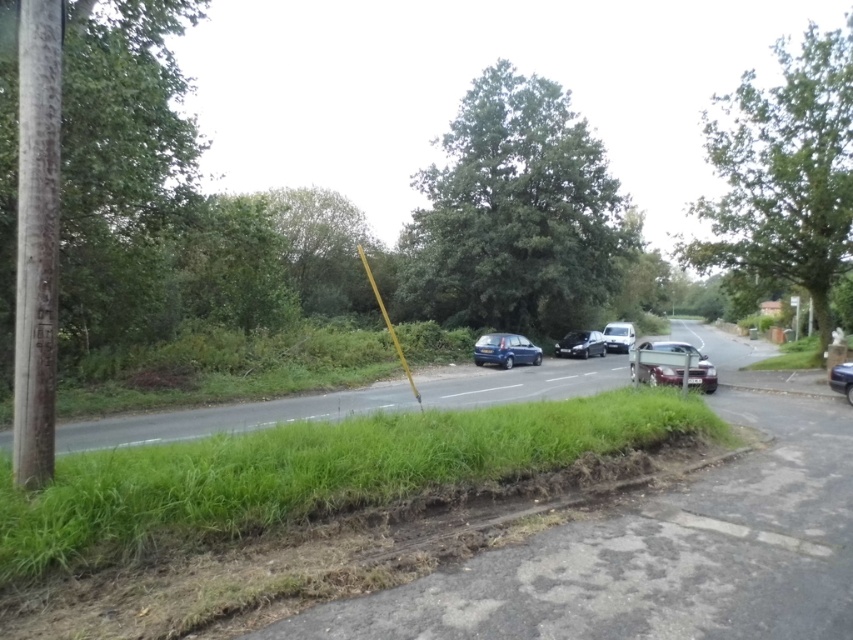
Question: Which of these objects is positioned closest to the green leafy tree at upper center?

Choices:
 (A) shiny silver car at center
 (B) satin black car at center

Answer: (B)

Question: Is shiny metallic car at center bigger than shiny blue sedan at right?

Choices:
 (A) no
 (B) yes

Answer: (B)

Question: Which object is positioned closest to the shiny silver car at center?

Choices:
 (A) satin black car at center
 (B) matte blue hatchback at center
 (C) yellow plastic pole at center
 (D) green grass at center

Answer: (A)

Question: Can you confirm if green leafy tree at upper right is wider than shiny blue sedan at right?

Choices:
 (A) yes
 (B) no

Answer: (A)

Question: Which point is closer to the camera?

Choices:
 (A) green grass at center
 (B) shiny silver car at center
 (C) shiny blue sedan at right

Answer: (A)

Question: Is green leafy tree at left below yellow plastic pole at center?

Choices:
 (A) no
 (B) yes

Answer: (A)